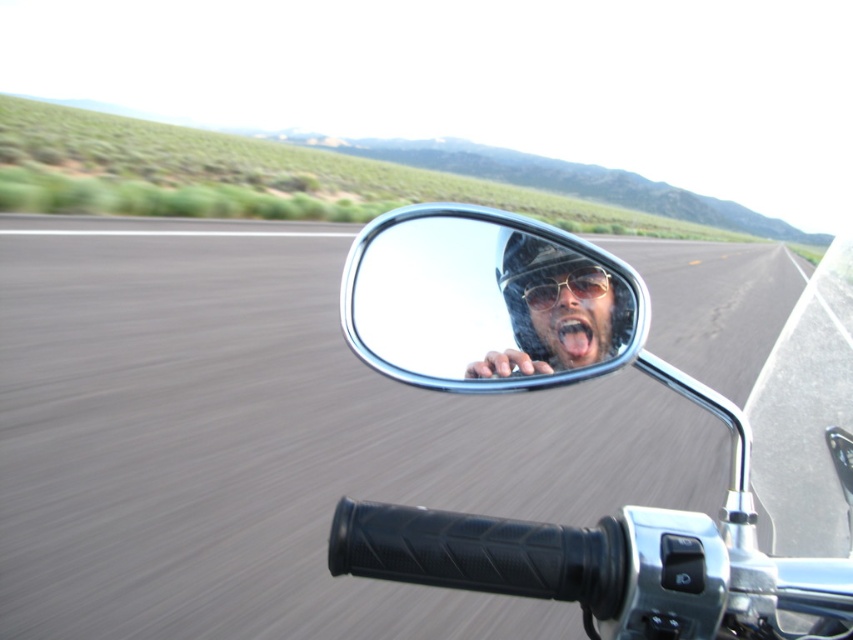
Question: Is shiny metallic helmet at center above shiny metallic helmet at side mirror?

Choices:
 (A) yes
 (B) no

Answer: (A)

Question: Does silver metallic mirror at center appear under metallic reflective sunglasses at center?

Choices:
 (A) yes
 (B) no

Answer: (A)

Question: Which is farther from the shiny metallic helmet at center?

Choices:
 (A) shiny metallic helmet at side mirror
 (B) silver metallic mirror at center
 (C) asphalt road at center
 (D) metallic reflective sunglasses at center

Answer: (C)

Question: Among these points, which one is farthest from the camera?

Choices:
 (A) (602, 324)
 (B) (548, 232)
 (C) (601, 326)
 (D) (518, 266)

Answer: (D)

Question: Estimate the real-world distances between objects in this image. Which object is farther from the metallic reflective sunglasses at center?

Choices:
 (A) asphalt road at center
 (B) shiny metallic helmet at center
 (C) silver metallic mirror at center
 (D) shiny metallic helmet at side mirror

Answer: (A)

Question: Is asphalt road at center to the right of silver metallic mirror at center from the viewer's perspective?

Choices:
 (A) yes
 (B) no

Answer: (A)